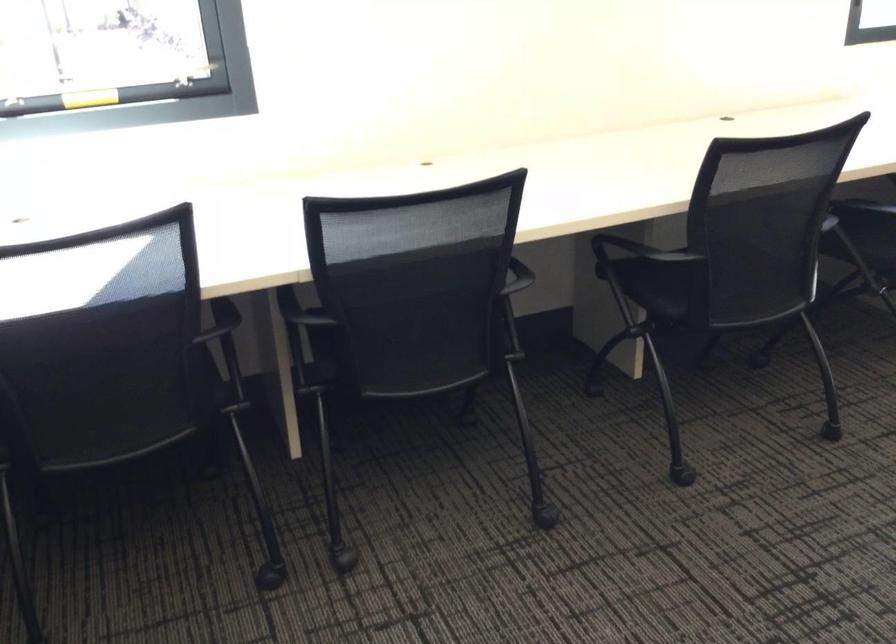
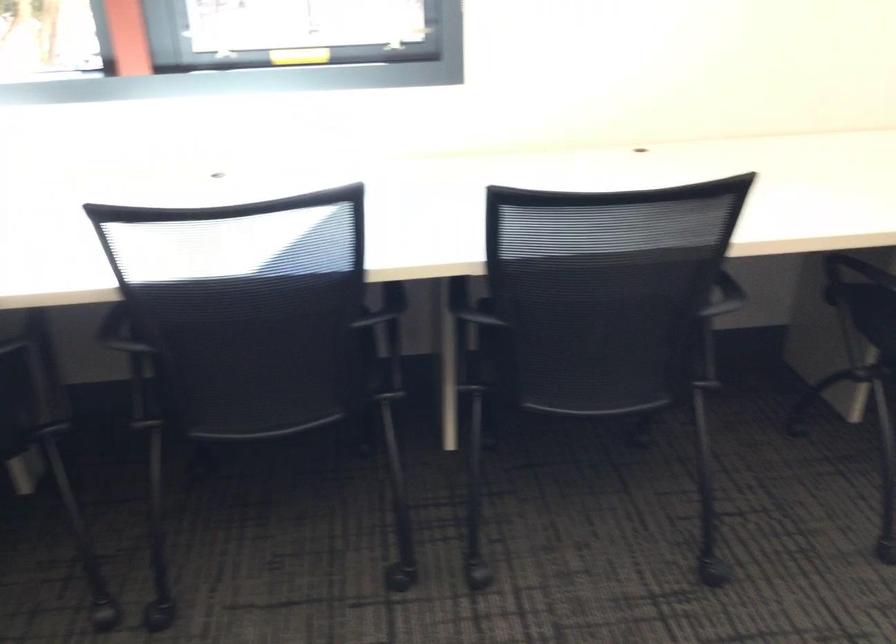
Question: Based on the continuous images, in which direction is the camera rotating? Reply with the corresponding letter.

Choices:
 (A) Left
 (B) Right
 (C) Up
 (D) Down

Answer: (A)